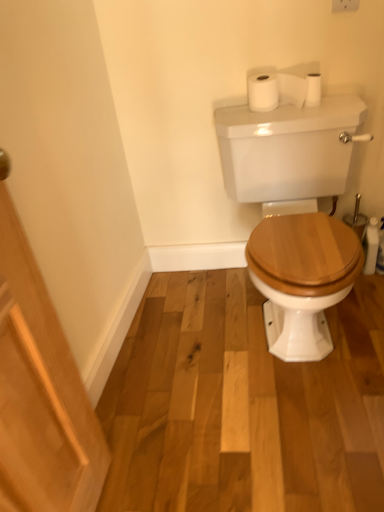
In order to face white matte toilet paper at upper right, the first toilet paper when ordered from right to left, should I rotate leftwards or rightwards?

To align with it, rotate right about 15.718°.

This screenshot has width=384, height=512. What do you see at coordinates (313, 89) in the screenshot?
I see `white matte toilet paper at upper right, the 2th toilet paper viewed from the left` at bounding box center [313, 89].

At what (x,y) coordinates should I click in order to perform the action: click on white glossy porcelain at center. Please return your answer as a coordinate pair (x, y). The image size is (384, 512). Looking at the image, I should click on (289, 152).

From the image's perspective, is white glossy porcelain at center located above white matte toilet paper at upper right, the 2th toilet paper viewed from the left?

No, from the image's perspective, white glossy porcelain at center is not over white matte toilet paper at upper right, the 2th toilet paper viewed from the left.

Does white glossy porcelain at center have a smaller size compared to white matte toilet paper at upper right, the first toilet paper when ordered from right to left?

Actually, white glossy porcelain at center might be larger than white matte toilet paper at upper right, the first toilet paper when ordered from right to left.

From a real-world perspective, which is physically above, white glossy porcelain at center or white matte toilet paper at upper right, the first toilet paper when ordered from right to left?

In real-world perspective, white matte toilet paper at upper right, the first toilet paper when ordered from right to left, is above.

This screenshot has width=384, height=512. What are the coordinates of `the 2nd toilet paper behind the white glossy porcelain at center` in the screenshot? It's located at (313, 89).

From the image's perspective, is white matte toilet paper at upper center, which is the 1th toilet paper from left to right, above white matte toilet paper at upper right, the first toilet paper when ordered from right to left?

Indeed, from the image's perspective, white matte toilet paper at upper center, which is the 1th toilet paper from left to right, is shown above white matte toilet paper at upper right, the first toilet paper when ordered from right to left.

Is white matte toilet paper at upper center, which is the 1th toilet paper from left to right, bigger than white matte toilet paper at upper right, the 2th toilet paper viewed from the left?

Yes.

From the picture: Is white matte toilet paper at upper center, which is counted as the second toilet paper, starting from the right, positioned far away from white matte toilet paper at upper right, the 2th toilet paper viewed from the left?

They are positioned close to each other.

Does point (316, 75) come farther from viewer compared to point (315, 87)?

Yes, it is.

Do you think white matte toilet paper at upper right, the first toilet paper when ordered from right to left, is within white glossy porcelain at center, or outside of it?

white matte toilet paper at upper right, the first toilet paper when ordered from right to left, lies outside white glossy porcelain at center.

Does white matte toilet paper at upper right, the 2th toilet paper viewed from the left, turn towards white glossy porcelain at center?

No, white matte toilet paper at upper right, the 2th toilet paper viewed from the left, is not oriented towards white glossy porcelain at center.

Between white matte toilet paper at upper right, the first toilet paper when ordered from right to left, and white glossy porcelain at center, which one has larger width?

white glossy porcelain at center.

From the image's perspective, starting from the white glossy porcelain at center, which toilet paper is the 1st one above? Please provide its 2D coordinates.

[(313, 89)]

From a real-world perspective, which is physically above, white matte toilet paper at upper right, the first toilet paper when ordered from right to left, or white matte toilet paper at upper center, which is counted as the second toilet paper, starting from the right?

From a 3D spatial view, white matte toilet paper at upper center, which is counted as the second toilet paper, starting from the right, is above.

Where is `toilet paper that is above the white matte toilet paper at upper right, the 2th toilet paper viewed from the left (from a real-world perspective)`? This screenshot has height=512, width=384. toilet paper that is above the white matte toilet paper at upper right, the 2th toilet paper viewed from the left (from a real-world perspective) is located at coordinates (275, 90).

Can you tell me how much white matte toilet paper at upper right, the 2th toilet paper viewed from the left, and white matte toilet paper at upper center, which is counted as the second toilet paper, starting from the right, differ in facing direction?

1.7 degrees separate the facing orientations of white matte toilet paper at upper right, the 2th toilet paper viewed from the left, and white matte toilet paper at upper center, which is counted as the second toilet paper, starting from the right.

Is white matte toilet paper at upper right, the first toilet paper when ordered from right to left, aimed at white matte toilet paper at upper center, which is counted as the second toilet paper, starting from the right?

No, white matte toilet paper at upper right, the first toilet paper when ordered from right to left, is not turned towards white matte toilet paper at upper center, which is counted as the second toilet paper, starting from the right.

Is white matte toilet paper at upper center, which is counted as the second toilet paper, starting from the right, a part of white glossy porcelain at center?

No.

Can you confirm if white glossy porcelain at center is thinner than white matte toilet paper at upper center, which is the 1th toilet paper from left to right?

Incorrect, the width of white glossy porcelain at center is not less than that of white matte toilet paper at upper center, which is the 1th toilet paper from left to right.

Is white glossy porcelain at center not near white matte toilet paper at upper center, which is counted as the second toilet paper, starting from the right?

No, white glossy porcelain at center is not far away from white matte toilet paper at upper center, which is counted as the second toilet paper, starting from the right.

Who is bigger, white glossy porcelain at center or white matte toilet paper at upper center, which is the 1th toilet paper from left to right?

Bigger between the two is white glossy porcelain at center.

Is white matte toilet paper at upper center, which is the 1th toilet paper from left to right, oriented towards white glossy porcelain at center?

No, white matte toilet paper at upper center, which is the 1th toilet paper from left to right, does not turn towards white glossy porcelain at center.

From the image's perspective, is white matte toilet paper at upper center, which is the 1th toilet paper from left to right, located above or below white glossy porcelain at center?

Based on their image positions, white matte toilet paper at upper center, which is the 1th toilet paper from left to right, is located above white glossy porcelain at center.

At what (x,y) coordinates should I click in order to perform the action: click on porcelain below the white matte toilet paper at upper center, which is counted as the second toilet paper, starting from the right (from the image's perspective). Please return your answer as a coordinate pair (x, y). Looking at the image, I should click on (289, 152).

Is white matte toilet paper at upper center, which is the 1th toilet paper from left to right, directly adjacent to white glossy porcelain at center?

No, white matte toilet paper at upper center, which is the 1th toilet paper from left to right, is not next to white glossy porcelain at center.

This screenshot has height=512, width=384. Identify the location of porcelain in front of the white matte toilet paper at upper right, the 2th toilet paper viewed from the left. (289, 152).

At what (x,y) coordinates should I click in order to perform the action: click on toilet paper located above the white matte toilet paper at upper right, the 2th toilet paper viewed from the left (from the image's perspective). Please return your answer as a coordinate pair (x, y). This screenshot has height=512, width=384. Looking at the image, I should click on (275, 90).

Based on their spatial positions, is white matte toilet paper at upper right, the 2th toilet paper viewed from the left, or white glossy porcelain at center further from white matte toilet paper at upper center, which is the 1th toilet paper from left to right?

white glossy porcelain at center.

Considering their positions, is white matte toilet paper at upper center, which is counted as the second toilet paper, starting from the right, positioned closer to white matte toilet paper at upper right, the first toilet paper when ordered from right to left, than white glossy porcelain at center?

white matte toilet paper at upper center, which is counted as the second toilet paper, starting from the right.

Considering their positions, is white matte toilet paper at upper right, the first toilet paper when ordered from right to left, positioned further to white glossy porcelain at center than white matte toilet paper at upper center, which is the 1th toilet paper from left to right?

white matte toilet paper at upper right, the first toilet paper when ordered from right to left, is further to white glossy porcelain at center.

Which object lies nearer to the anchor point white matte toilet paper at upper right, the first toilet paper when ordered from right to left, white glossy porcelain at center or white matte toilet paper at upper center, which is the 1th toilet paper from left to right?

white matte toilet paper at upper center, which is the 1th toilet paper from left to right.

Which object lies nearer to the anchor point white matte toilet paper at upper center, which is counted as the second toilet paper, starting from the right, white glossy porcelain at center or white matte toilet paper at upper right, the first toilet paper when ordered from right to left?

Based on the image, white matte toilet paper at upper right, the first toilet paper when ordered from right to left, appears to be nearer to white matte toilet paper at upper center, which is counted as the second toilet paper, starting from the right.

Considering their positions, is white matte toilet paper at upper center, which is the 1th toilet paper from left to right, positioned further to white glossy porcelain at center than white matte toilet paper at upper right, the first toilet paper when ordered from right to left?

Among the two, white matte toilet paper at upper right, the first toilet paper when ordered from right to left, is located further to white glossy porcelain at center.

Find the location of a particular element. toilet paper between white matte toilet paper at upper center, which is counted as the second toilet paper, starting from the right, and white glossy porcelain at center vertically is located at coordinates pyautogui.click(x=313, y=89).